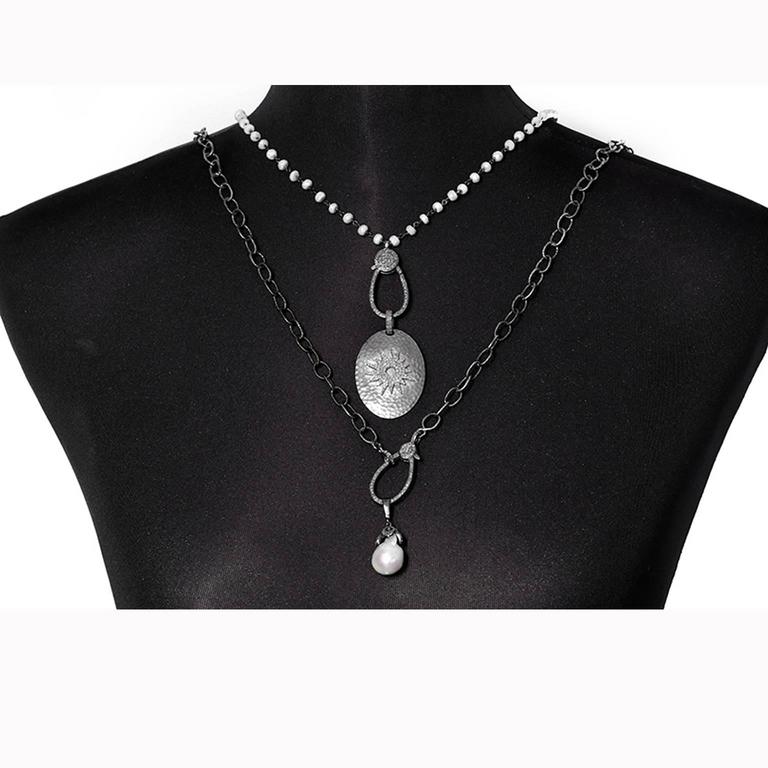
Locate an element on the screen. large metal pendant is located at coordinates (398, 369).